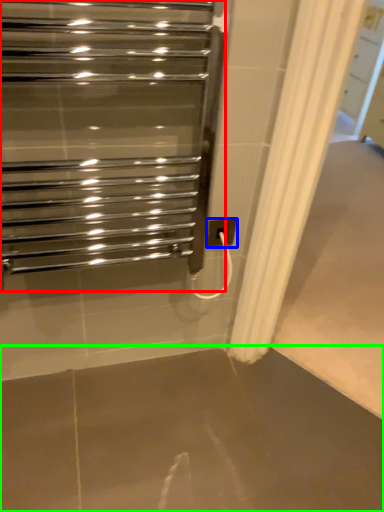
Question: Based on their relative distances, which object is nearer to home appliance (highlighted by a red box)? Choose from electric outlet (highlighted by a blue box) and concrete (highlighted by a green box).

Choices:
 (A) electric outlet
 (B) concrete

Answer: (A)